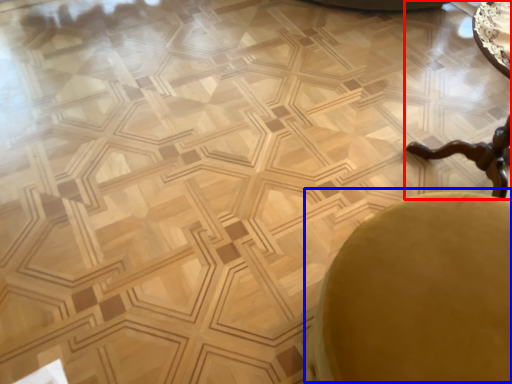
Question: Among these objects, which one is farthest to the camera, cocktail table (highlighted by a red box) or swivel chair (highlighted by a blue box)?

Choices:
 (A) cocktail table
 (B) swivel chair

Answer: (A)